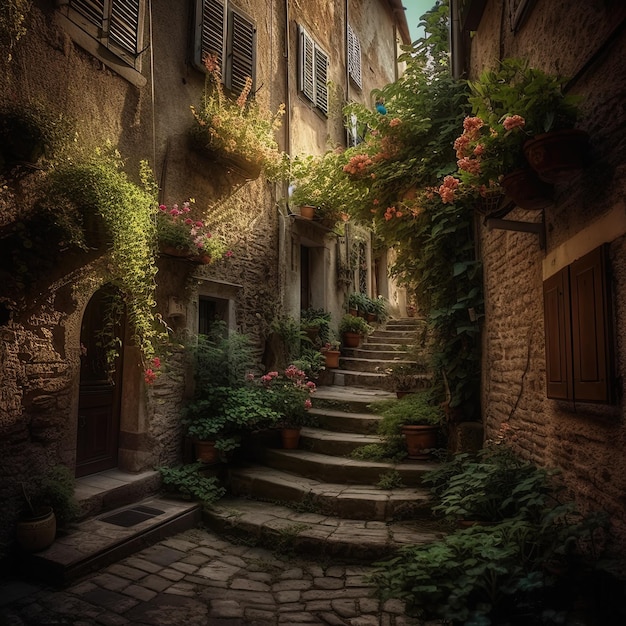
This screenshot has width=626, height=626. I want to click on doorways, so click(x=135, y=404), click(x=320, y=295), click(x=227, y=317), click(x=382, y=284).